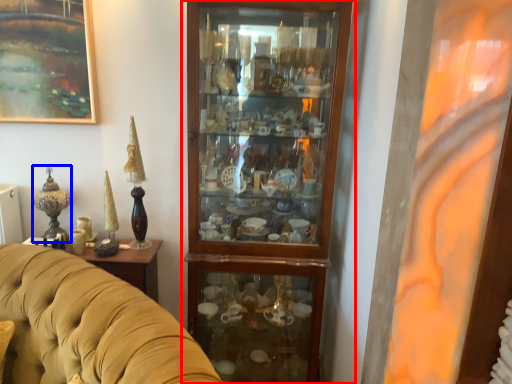
Question: Among these objects, which one is nearest to the camera, cupboard (highlighted by a red box) or candle holder (highlighted by a blue box)?

Choices:
 (A) cupboard
 (B) candle holder

Answer: (A)